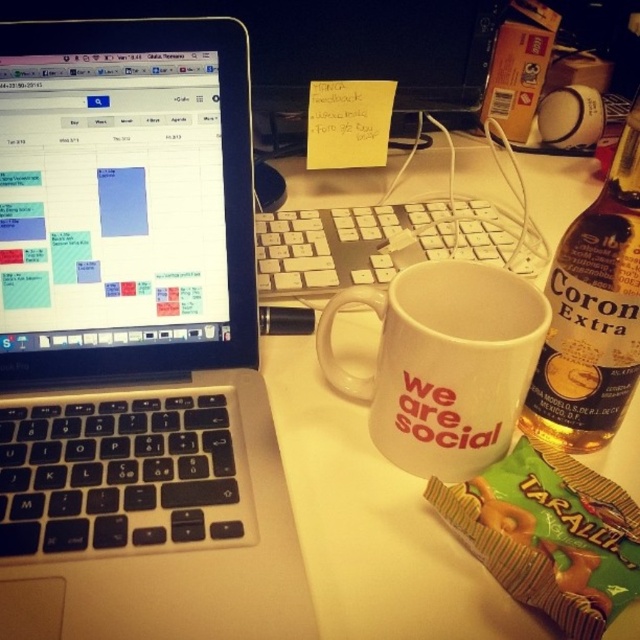
Can you confirm if white matte mug at center is taller than white plastic keyboard at center?

Correct, white matte mug at center is much taller as white plastic keyboard at center.

Is white matte mug at center bigger than white plastic keyboard at center?

Actually, white matte mug at center might be smaller than white plastic keyboard at center.

Locate an element on the screen. The image size is (640, 640). white matte mug at center is located at coordinates (444, 364).

Locate an element on the screen. white matte mug at center is located at coordinates (444, 364).

Can you confirm if white plastic table at center is positioned below translucent glass bottle at right?

No, white plastic table at center is not below translucent glass bottle at right.

Can you confirm if white plastic table at center is wider than translucent glass bottle at right?

Indeed, white plastic table at center has a greater width compared to translucent glass bottle at right.

What do you see at coordinates (372, 524) in the screenshot? The height and width of the screenshot is (640, 640). I see `white plastic table at center` at bounding box center [372, 524].

Where is `white plastic table at center`? The width and height of the screenshot is (640, 640). white plastic table at center is located at coordinates (372, 524).

Looking at this image, which is more to the left, silver/black plastic laptop at upper left or white plastic table at center?

silver/black plastic laptop at upper left is more to the left.

Does silver/black plastic laptop at upper left have a greater width compared to white plastic table at center?

Incorrect, silver/black plastic laptop at upper left's width does not surpass white plastic table at center's.

Between point (17, 186) and point (552, 637), which one is positioned in front?

Point (552, 637)

The image size is (640, 640). Identify the location of silver/black plastic laptop at upper left. pos(134,342).